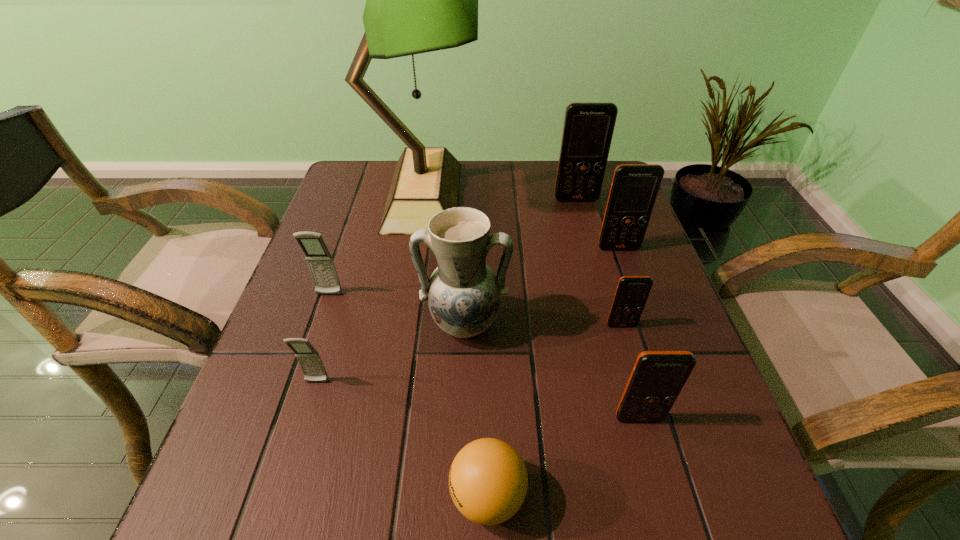
Locate which object is the seventh closest to the ping-pong ball. Please provide its 2D coordinates. Your answer should be formatted as a tuple, i.e. [(x, y)], where the tuple contains the x and y coordinates of a point satisfying the conditions above.

[(418, 0)]

Locate an element on the screen. The image size is (960, 540). the sixth closest cellular telephone relative to the nearest object is located at coordinates (588, 128).

Identify which cellular telephone is the fifth closest to the nearer gray cellular telephone. Please provide its 2D coordinates. Your answer should be formatted as a tuple, i.e. [(x, y)], where the tuple contains the x and y coordinates of a point satisfying the conditions above.

[(588, 128)]

Identify the location of the third closest orange cellular telephone to the nearest cellular telephone. (588, 128).

Where is `orange cellular telephone that can be found as the closest to the fifth shortest cellular telephone`? orange cellular telephone that can be found as the closest to the fifth shortest cellular telephone is located at coordinates click(588, 128).

Where is `free location that satisfies the following two spatial constraints: 1. on the screen of the biggest orange cellular telephone; 2. on the side with brand of the shortest object`? Image resolution: width=960 pixels, height=540 pixels. free location that satisfies the following two spatial constraints: 1. on the screen of the biggest orange cellular telephone; 2. on the side with brand of the shortest object is located at coordinates (658, 495).

Identify the location of vacant point that satisfies the following two spatial constraints: 1. on the screen of the farthest cellular telephone; 2. on the side with brand of the shortest object. (658, 495).